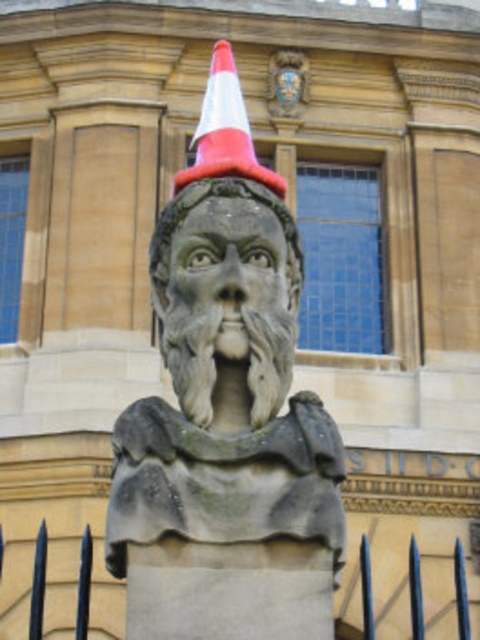
You are an art student observing the scene. You notice the gray stone face at center and the white and orange cone at center. Which object is positioned higher in the image?

The white and orange cone at center is positioned higher because the gray stone face at center is located below it.

You are standing in front of the stone bust wearing a traffic cone. There are two points marked on the cone. One is at coordinate point(252, 268) and the other at point(265, 291). Which point is closer to you?

Point(252, 268) is closer to you because it is further to the viewer than point(265, 291).